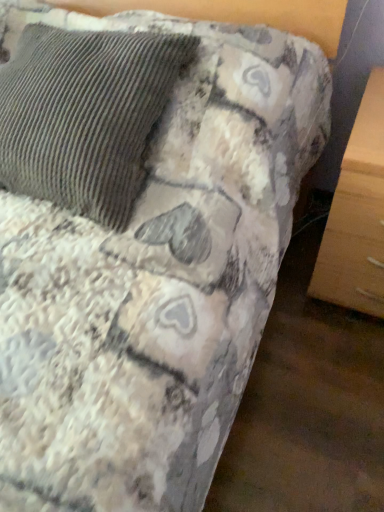
At what (x,y) coordinates should I click in order to perform the action: click on vacant space that is to the left of light wood drawer at lower right. Please return your answer as a coordinate pair (x, y). Looking at the image, I should click on (292, 290).